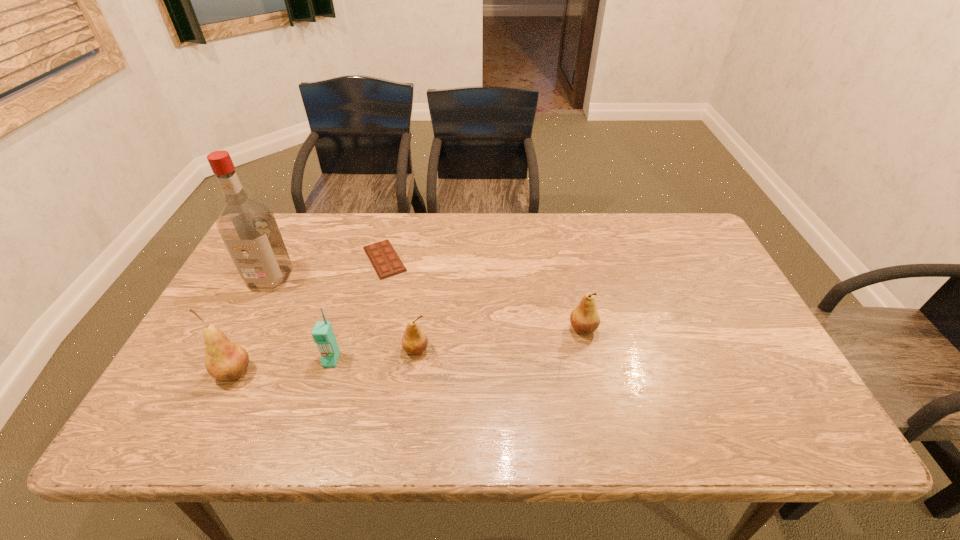
Please show where to add a pear on the right while keeping spacing even. Please provide its 2D coordinates. Your answer should be formatted as a tuple, i.e. [(x, y)], where the tuple contains the x and y coordinates of a point satisfying the conditions above.

[(736, 310)]